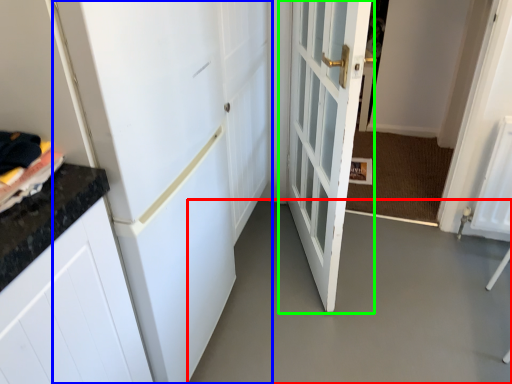
Question: Based on their relative distances, which object is farther from concrete (highlighted by a red box)? Choose from door (highlighted by a blue box) and door (highlighted by a green box).

Choices:
 (A) door
 (B) door

Answer: (A)